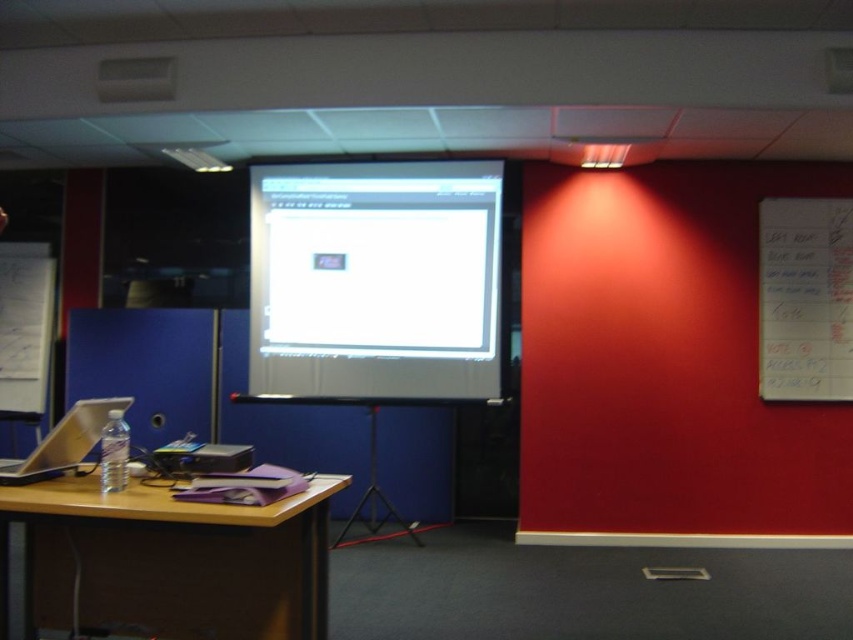
Question: Can you confirm if white paper at left is positioned below matte silver laptop at left?

Choices:
 (A) yes
 (B) no

Answer: (B)

Question: Considering the real-world distances, which object is closest to the brown wooden table at lower left?

Choices:
 (A) white paper at upper right
 (B) matte silver laptop at left
 (C) white paper at left

Answer: (B)

Question: Considering the real-world distances, which object is farthest from the black plastic projector at lower left?

Choices:
 (A) brown wooden table at lower left
 (B) white glossy projector screen at center
 (C) white paper at left

Answer: (C)

Question: Is white paper at upper right closer to the viewer compared to matte silver laptop at left?

Choices:
 (A) no
 (B) yes

Answer: (A)

Question: Which object appears farthest from the camera in this image?

Choices:
 (A) matte silver laptop at left
 (B) white paper at upper right
 (C) black plastic projector at lower left

Answer: (B)

Question: Can you confirm if brown wooden table at lower left is positioned below black plastic projector at lower left?

Choices:
 (A) no
 (B) yes

Answer: (B)